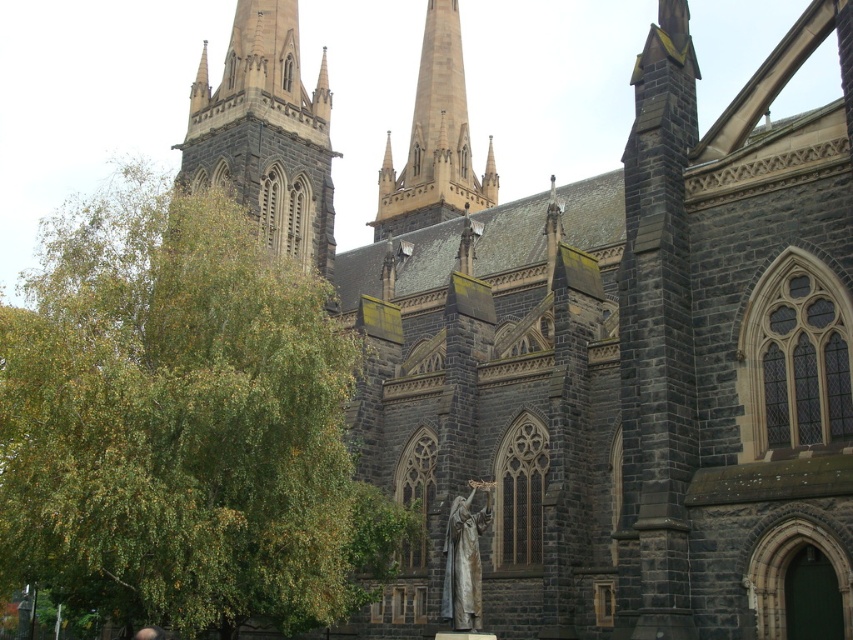
Can you confirm if dark gray stone tower at upper left is positioned above bronze statue at center?

Yes.

Between point (242, 8) and point (445, 531), which one is positioned in front?

Point (445, 531) is in front.

Find the location of `dark gray stone tower at upper left`. dark gray stone tower at upper left is located at coordinates (265, 132).

Does point (291, 488) come in front of point (444, 616)?

Yes, point (291, 488) is closer to viewer.

Does point (389, 512) come in front of point (476, 592)?

That is False.

This screenshot has width=853, height=640. What are the coordinates of `green leafy tree at left` in the screenshot? It's located at (181, 424).

Can you confirm if dark gray stone tower at upper left is wider than light brown stone spire at upper center?

Yes, dark gray stone tower at upper left is wider than light brown stone spire at upper center.

Is dark gray stone tower at upper left shorter than light brown stone spire at upper center?

Yes.

Which is in front, point (302, 148) or point (438, 202)?

Positioned in front is point (302, 148).

Find the location of `dark gray stone tower at upper left`. dark gray stone tower at upper left is located at coordinates (265, 132).